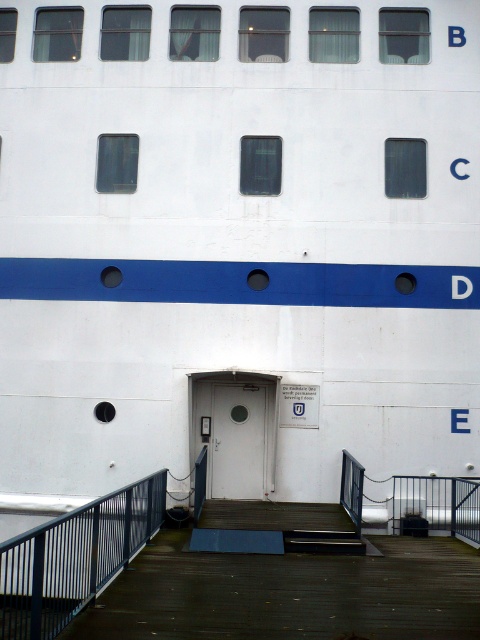
Question: Is blue metal railing at lower left above wooden deck stairs at center?

Choices:
 (A) yes
 (B) no

Answer: (A)

Question: Which point is closer to the camera?

Choices:
 (A) (263, 394)
 (B) (119, 545)

Answer: (B)

Question: Considering the real-world distances, which object is farthest from the white matte door at center?

Choices:
 (A) wooden deck stairs at center
 (B) blue metal railing at lower left

Answer: (B)

Question: Which of the following is the closest to the observer?

Choices:
 (A) (239, 524)
 (B) (216, 404)
 (C) (123, 557)

Answer: (C)

Question: Can you confirm if wooden deck stairs at center is positioned above white matte door at center?

Choices:
 (A) yes
 (B) no

Answer: (B)

Question: Does blue metal railing at lower left have a greater width compared to white matte door at center?

Choices:
 (A) no
 (B) yes

Answer: (A)